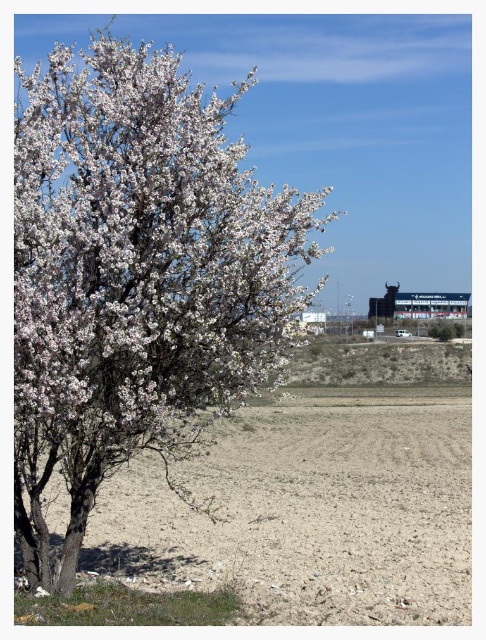
Is white matte tree at left to the left of dull brown soil at lower left from the viewer's perspective?

Correct, you'll find white matte tree at left to the left of dull brown soil at lower left.

Is the position of white matte tree at left more distant than that of dull brown soil at lower left?

No, it is in front of dull brown soil at lower left.

Measure the distance between point (27,344) and camera.

Point (27,344) and camera are 18.58 feet apart from each other.

Locate an element on the screen. The width and height of the screenshot is (486, 640). white matte tree at left is located at coordinates (136, 273).